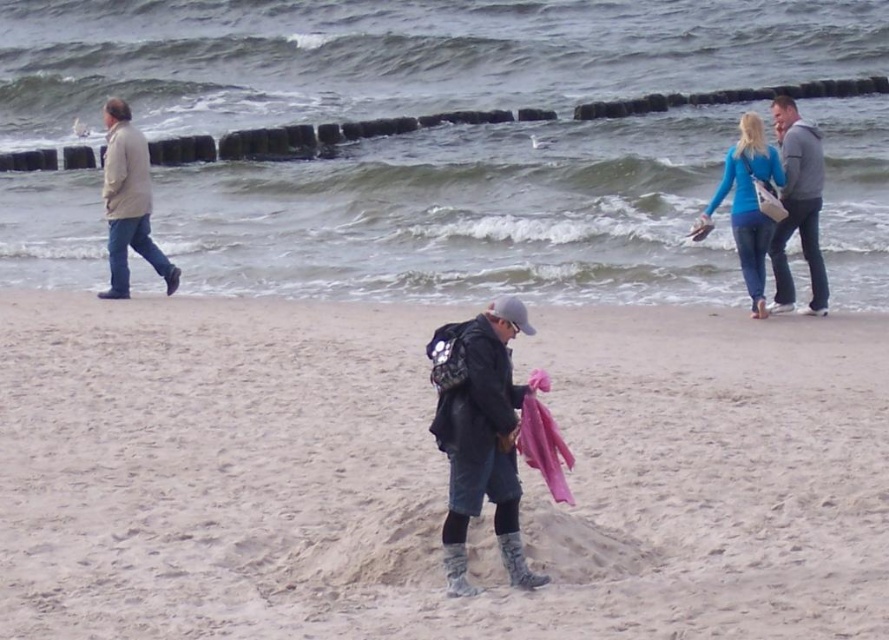
Is smooth sand at center thinner than blue matte jacket at upper right?

No.

Does smooth sand at center appear on the left side of blue matte jacket at upper right?

Correct, you'll find smooth sand at center to the left of blue matte jacket at upper right.

Who is more distant from viewer, [260,595] or [747,168]?

The point [747,168] is behind.

The height and width of the screenshot is (640, 889). What are the coordinates of `smooth sand at center` in the screenshot? It's located at (431, 474).

Does smooth sand at center have a lesser width compared to light brown leather jacket at left?

Incorrect, smooth sand at center's width is not less than light brown leather jacket at left's.

This screenshot has height=640, width=889. What do you see at coordinates (431, 474) in the screenshot? I see `smooth sand at center` at bounding box center [431, 474].

What do you see at coordinates (431, 474) in the screenshot?
I see `smooth sand at center` at bounding box center [431, 474].

Find the location of `smooth sand at center`. smooth sand at center is located at coordinates (431, 474).

Does point (449, 532) come farther from viewer compared to point (739, 253)?

No, it is not.

Who is lower down, matte black jacket at center or blue matte jacket at upper right?

matte black jacket at center is below.

Which is in front, point (462, 540) or point (759, 218)?

Point (462, 540) is in front.

Locate an element on the screen. This screenshot has height=640, width=889. matte black jacket at center is located at coordinates (479, 435).